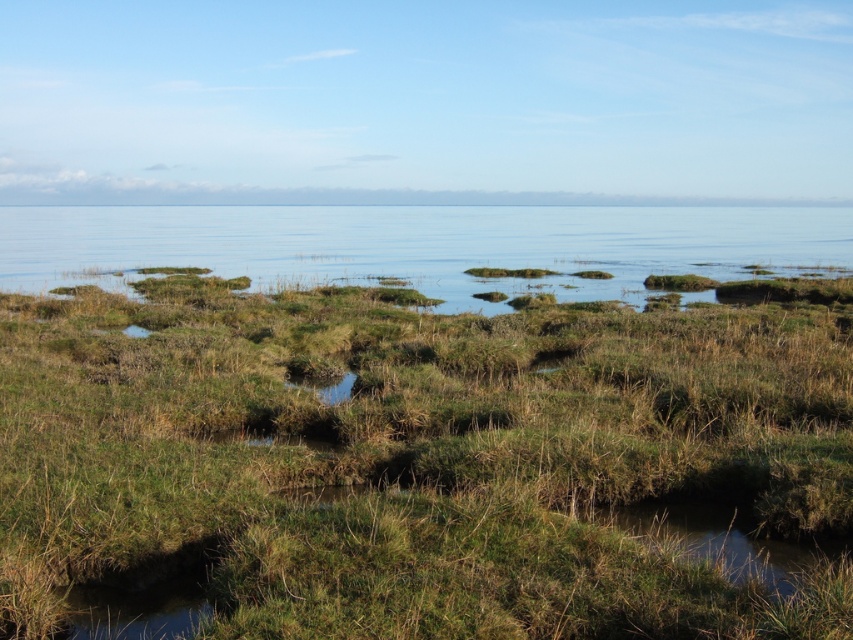
Question: In this image, where is green grassy at center located relative to clear blue water at center?

Choices:
 (A) right
 (B) left

Answer: (A)

Question: Does green grassy at center come in front of clear blue water at center?

Choices:
 (A) yes
 (B) no

Answer: (A)

Question: Can you confirm if green grassy at center is positioned below clear blue water at center?

Choices:
 (A) no
 (B) yes

Answer: (B)

Question: Which object appears farthest from the camera in this image?

Choices:
 (A) green grassy at center
 (B) clear blue water at center

Answer: (B)

Question: Among these objects, which one is nearest to the camera?

Choices:
 (A) green grassy at center
 (B) clear blue water at center

Answer: (A)